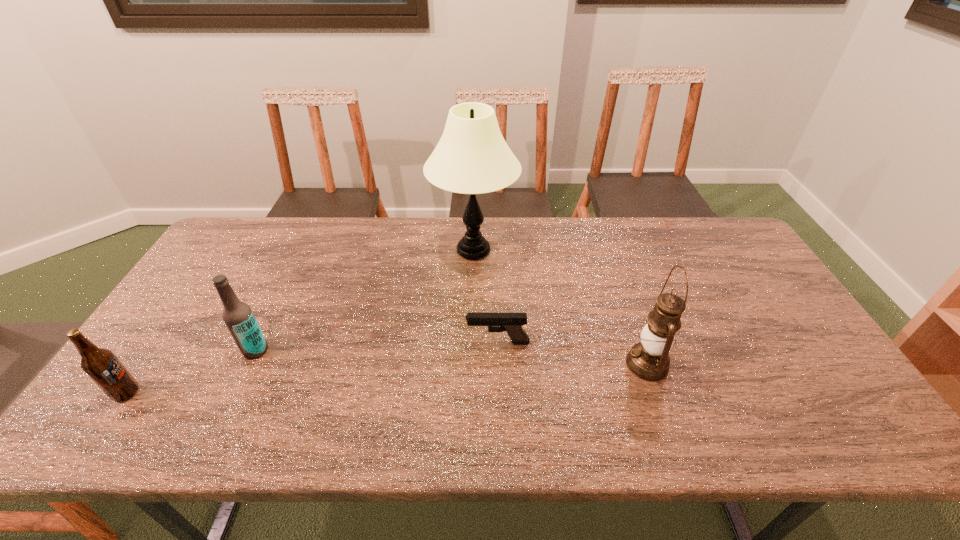
Image resolution: width=960 pixels, height=540 pixels. Find the location of `vacant region located on the back of the fourth shortest object`. vacant region located on the back of the fourth shortest object is located at coordinates (631, 316).

At what (x,y) coordinates should I click in order to perform the action: click on free point located on the label of the fourth object from right to left. Please return your answer as a coordinate pair (x, y). This screenshot has width=960, height=540. Looking at the image, I should click on (228, 409).

Find the location of `free space located 0.130m on the label of the fourth tallest object`. free space located 0.130m on the label of the fourth tallest object is located at coordinates (x=192, y=393).

This screenshot has width=960, height=540. Identify the location of free location located on the front-facing side of the shortest object. (440, 342).

This screenshot has width=960, height=540. In order to click on free spot located 0.110m on the front-facing side of the shortest object in this screenshot , I will do `click(424, 342)`.

Where is `vacant space situated on the front-facing side of the shortest object`? Image resolution: width=960 pixels, height=540 pixels. vacant space situated on the front-facing side of the shortest object is located at coordinates (391, 342).

This screenshot has height=540, width=960. I want to click on object located in the far edge section of the desktop, so click(472, 157).

Where is `object situated at the left edge`? object situated at the left edge is located at coordinates (101, 365).

This screenshot has height=540, width=960. Find the location of `vacant region at the far edge of the desktop`. vacant region at the far edge of the desktop is located at coordinates (399, 227).

At what (x,y) coordinates should I click in order to perform the action: click on blank space at the left edge of the desktop. Please return your answer as a coordinate pair (x, y). This screenshot has height=540, width=960. Looking at the image, I should click on (160, 358).